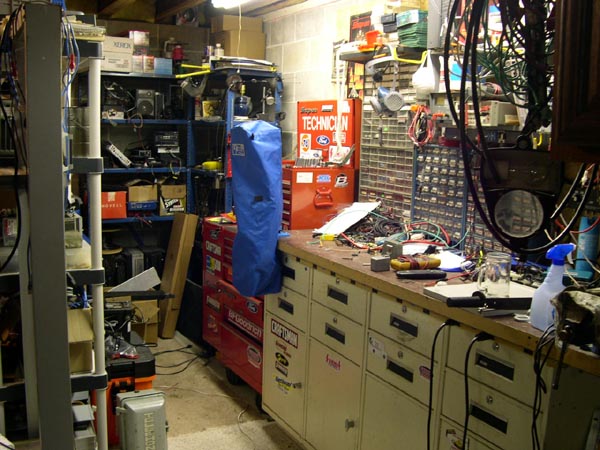
I want to click on concrete floor, so click(201, 413).